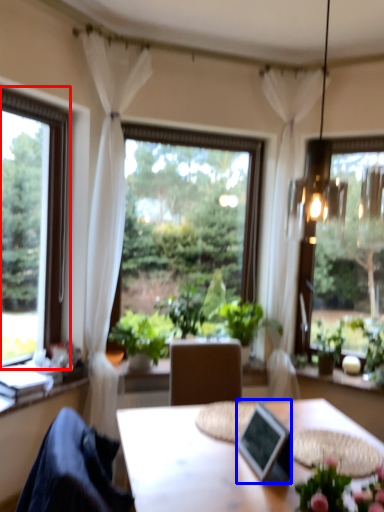
Question: Which object appears closest to the camera in this image, window (highlighted by a red box) or picture frame (highlighted by a blue box)?

Choices:
 (A) window
 (B) picture frame

Answer: (B)